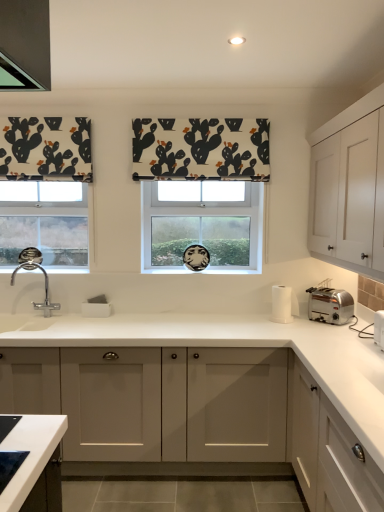
The width and height of the screenshot is (384, 512). Identify the location of free space in front of white paper towel holder at right, positioned as the 1th appliance in back-to-front order. tap(291, 326).